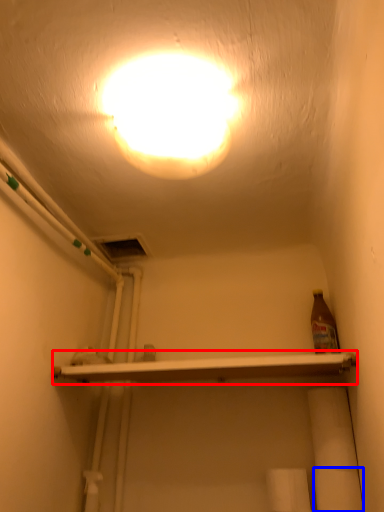
Question: Which of the following is the farthest to the observer, shelf (highlighted by a red box) or toilet paper (highlighted by a blue box)?

Choices:
 (A) shelf
 (B) toilet paper

Answer: (B)